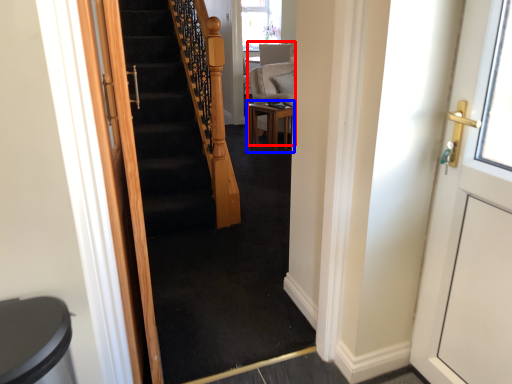
Question: Among these objects, which one is farthest to the camera, armchair (highlighted by a red box) or table (highlighted by a blue box)?

Choices:
 (A) armchair
 (B) table

Answer: (A)